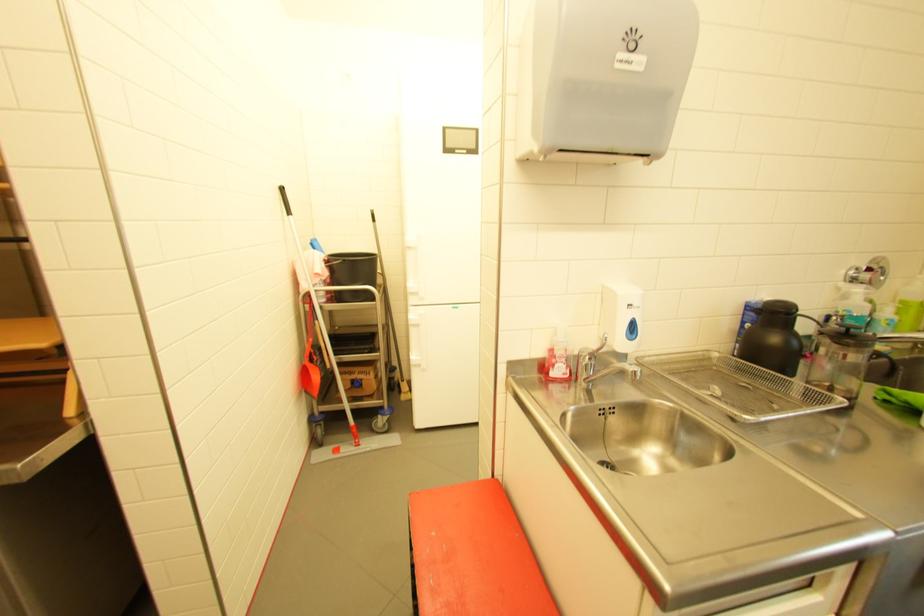
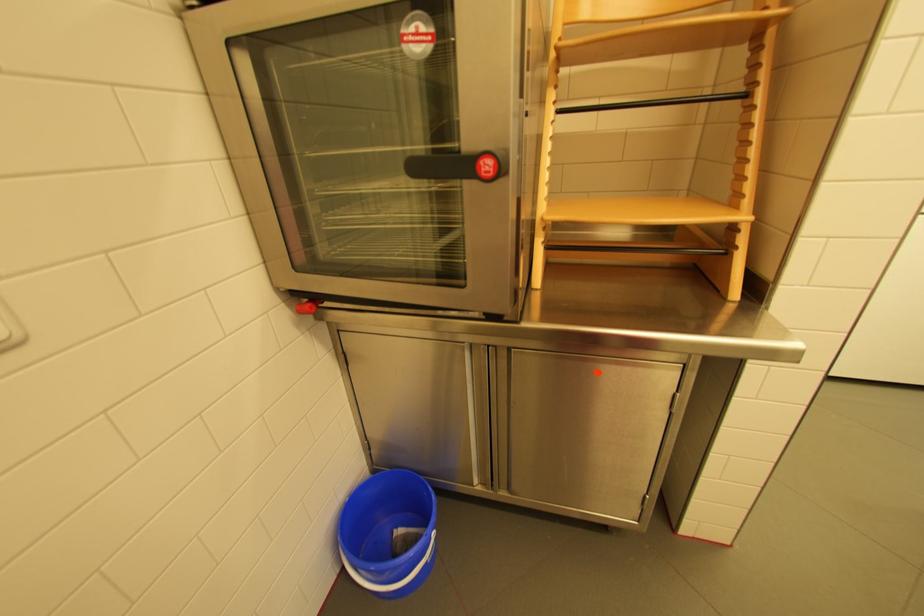
Question: What movement of the cameraman would produce the second image?

Choices:
 (A) Left
 (B) Right
 (C) Forward
 (D) Backward

Answer: (A)